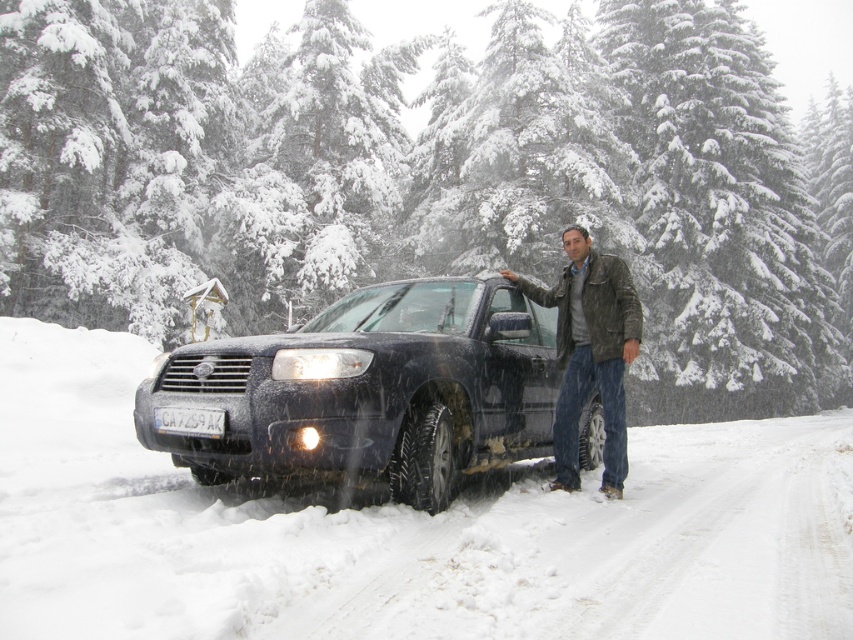
Who is positioned more to the right, matte black suv at center or leather jacket at center?

From the viewer's perspective, leather jacket at center appears more on the right side.

Can you confirm if matte black suv at center is positioned to the right of leather jacket at center?

In fact, matte black suv at center is to the left of leather jacket at center.

Locate an element on the screen. Image resolution: width=853 pixels, height=640 pixels. matte black suv at center is located at coordinates (370, 390).

Can you confirm if white powdery snow at center is positioned to the right of leather jacket at center?

Correct, you'll find white powdery snow at center to the right of leather jacket at center.

Can you confirm if white powdery snow at center is shorter than leather jacket at center?

No.

Is point (747, 520) less distant than point (614, 301)?

Yes, it is in front of point (614, 301).

Where is `white powdery snow at center`? white powdery snow at center is located at coordinates (404, 531).

Does snow-covered evergreen tree at center have a smaller size compared to matte black suv at center?

Incorrect, snow-covered evergreen tree at center is not smaller in size than matte black suv at center.

Can you confirm if snow-covered evergreen tree at center is shorter than matte black suv at center?

No, snow-covered evergreen tree at center is not shorter than matte black suv at center.

What do you see at coordinates (433, 177) in the screenshot?
I see `snow-covered evergreen tree at center` at bounding box center [433, 177].

Find the location of a particular element. The image size is (853, 640). snow-covered evergreen tree at center is located at coordinates (433, 177).